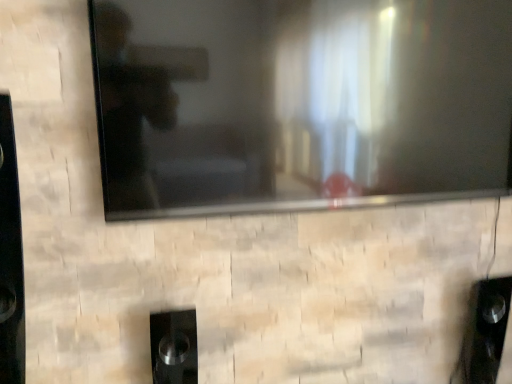
Image resolution: width=512 pixels, height=384 pixels. Describe the element at coordinates (300, 103) in the screenshot. I see `black glossy tv at upper center` at that location.

Image resolution: width=512 pixels, height=384 pixels. I want to click on black glossy tv at upper center, so 300,103.

At what (x,y) coordinates should I click in order to perform the action: click on black glossy speaker at lower center. Please return your answer as a coordinate pair (x, y). Looking at the image, I should click on (174, 347).

Describe the element at coordinates (174, 347) in the screenshot. I see `black glossy speaker at lower center` at that location.

Locate an element on the screen. black glossy tv at upper center is located at coordinates [300, 103].

Considering the positions of objects black glossy tv at upper center and black glossy speaker at lower center in the image provided, who is more to the right, black glossy tv at upper center or black glossy speaker at lower center?

From the viewer's perspective, black glossy tv at upper center appears more on the right side.

Considering the positions of objects black glossy tv at upper center and black glossy speaker at lower center in the image provided, who is behind, black glossy tv at upper center or black glossy speaker at lower center?

black glossy speaker at lower center is behind.

Between point (215, 164) and point (160, 333), which one is positioned behind?

The point (160, 333) is behind.

Based on the photo, from the image's perspective, is black glossy tv at upper center beneath black glossy speaker at lower center?

Incorrect, from the image's perspective, black glossy tv at upper center is higher than black glossy speaker at lower center.

From a real-world perspective, does black glossy tv at upper center stand above black glossy speaker at lower center?

Yes.

Does black glossy tv at upper center have a greater width compared to black glossy speaker at lower center?

In fact, black glossy tv at upper center might be narrower than black glossy speaker at lower center.

Considering the sizes of objects black glossy tv at upper center and black glossy speaker at lower center in the image provided, who is taller, black glossy tv at upper center or black glossy speaker at lower center?

With more height is black glossy tv at upper center.

From the picture: Is black glossy tv at upper center smaller than black glossy speaker at lower center?

No, black glossy tv at upper center is not smaller than black glossy speaker at lower center.

Do you think black glossy tv at upper center is within black glossy speaker at lower center, or outside of it?

black glossy tv at upper center is located beyond the bounds of black glossy speaker at lower center.

Are black glossy tv at upper center and black glossy speaker at lower center making contact?

No, black glossy tv at upper center is not in contact with black glossy speaker at lower center.

Is black glossy tv at upper center aimed at black glossy speaker at lower center?

No, black glossy tv at upper center does not turn towards black glossy speaker at lower center.

Looking at this image, how different are the orientations of black glossy tv at upper center and black glossy speaker at lower center in degrees?

The angle between the facing direction of black glossy tv at upper center and the facing direction of black glossy speaker at lower center is 0.000575 degrees.

Measure the distance from black glossy tv at upper center to black glossy speaker at lower center.

black glossy tv at upper center is 24.80 inches away from black glossy speaker at lower center.

Locate an element on the screen. This screenshot has height=384, width=512. speaker that is on the left side of black glossy tv at upper center is located at coordinates (174, 347).

Which is more to the left, black glossy speaker at lower center or black glossy tv at upper center?

From the viewer's perspective, black glossy speaker at lower center appears more on the left side.

From the picture: Which object is closer to the camera taking this photo, black glossy speaker at lower center or black glossy tv at upper center?

black glossy tv at upper center is more forward.

Does point (188, 367) appear closer or farther from the camera than point (381, 141)?

Point (188, 367) is farther from the camera than point (381, 141).

From the image's perspective, would you say black glossy speaker at lower center is shown under black glossy tv at upper center?

Indeed, from the image's perspective, black glossy speaker at lower center is shown beneath black glossy tv at upper center.

Looking at this image, from a real-world perspective, who is located lower, black glossy speaker at lower center or black glossy tv at upper center?

black glossy speaker at lower center, from a real-world perspective.

In terms of width, does black glossy speaker at lower center look wider or thinner when compared to black glossy tv at upper center?

Considering their sizes, black glossy speaker at lower center looks broader than black glossy tv at upper center.

Considering the relative sizes of black glossy speaker at lower center and black glossy tv at upper center in the image provided, is black glossy speaker at lower center taller than black glossy tv at upper center?

In fact, black glossy speaker at lower center may be shorter than black glossy tv at upper center.

Does black glossy speaker at lower center have a larger size compared to black glossy tv at upper center?

Incorrect, black glossy speaker at lower center is not larger than black glossy tv at upper center.

Do you think black glossy speaker at lower center is within black glossy tv at upper center, or outside of it?

black glossy speaker at lower center exists outside the volume of black glossy tv at upper center.

Is the surface of black glossy speaker at lower center in direct contact with black glossy tv at upper center?

black glossy speaker at lower center and black glossy tv at upper center are clearly separated.

Is black glossy speaker at lower center oriented away from black glossy tv at upper center?

black glossy speaker at lower center is not turned away from black glossy tv at upper center.

Can you tell me how much black glossy speaker at lower center and black glossy tv at upper center differ in facing direction?

black glossy speaker at lower center and black glossy tv at upper center are facing 0.000575 degrees away from each other.

What are the coordinates of `television in front of the black glossy speaker at lower center` in the screenshot? It's located at (300, 103).

The width and height of the screenshot is (512, 384). What are the coordinates of `television to the right of black glossy speaker at lower center` in the screenshot? It's located at (300, 103).

Where is `television above the black glossy speaker at lower center (from the image's perspective)`? This screenshot has width=512, height=384. television above the black glossy speaker at lower center (from the image's perspective) is located at coordinates (300, 103).